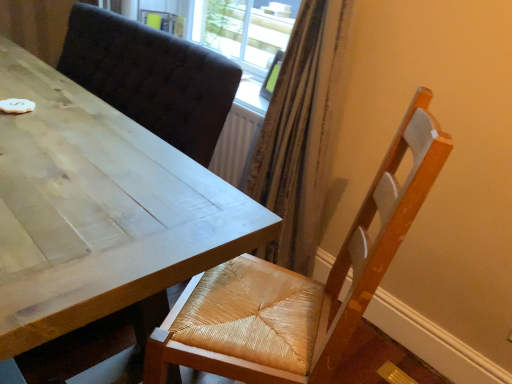
Question: Is light wood table at upper left inside or outside of woven wood chair at lower right?

Choices:
 (A) outside
 (B) inside

Answer: (A)

Question: Looking at the image, does light wood table at upper left seem bigger or smaller compared to woven wood chair at lower right?

Choices:
 (A) big
 (B) small

Answer: (A)

Question: From a real-world perspective, is light wood table at upper left positioned above or below woven wood chair at lower right?

Choices:
 (A) below
 (B) above

Answer: (A)

Question: From the image's perspective, is woven wood chair at lower right positioned above or below light wood table at upper left?

Choices:
 (A) above
 (B) below

Answer: (B)

Question: From a real-world perspective, is woven wood chair at lower right physically located above or below light wood table at upper left?

Choices:
 (A) above
 (B) below

Answer: (A)

Question: Is woven wood chair at lower right wider or thinner than light wood table at upper left?

Choices:
 (A) wide
 (B) thin

Answer: (A)

Question: Would you say woven wood chair at lower right is to the left or to the right of light wood table at upper left in the picture?

Choices:
 (A) right
 (B) left

Answer: (A)